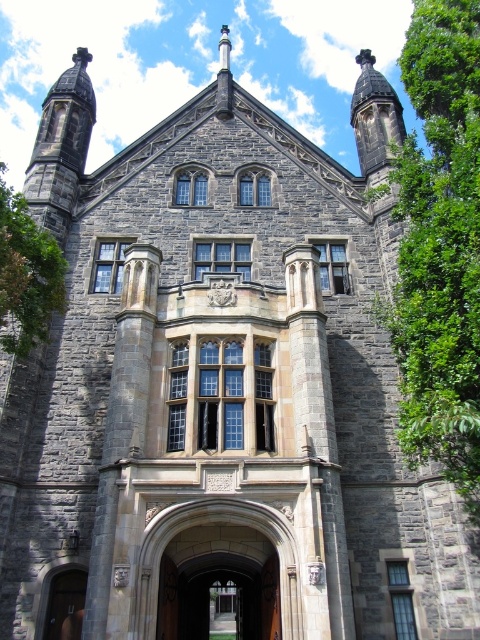
Question: Does green leafy tree at right have a lesser width compared to wooden door at center?

Choices:
 (A) yes
 (B) no

Answer: (B)

Question: Observing the image, what is the correct spatial positioning of green leafy tree at right in reference to wooden door at center?

Choices:
 (A) right
 (B) left

Answer: (A)

Question: Which point is farther to the camera?

Choices:
 (A) green leafy tree at left
 (B) green leafy tree at right

Answer: (A)

Question: Which of the following is the closest to the observer?

Choices:
 (A) (477, 516)
 (B) (31, 257)
 (C) (48, 625)

Answer: (C)

Question: Can you confirm if green leafy tree at right is positioned below green leafy tree at left?

Choices:
 (A) yes
 (B) no

Answer: (B)

Question: Which point appears farthest from the camera in this image?

Choices:
 (A) (436, 218)
 (B) (60, 588)

Answer: (B)